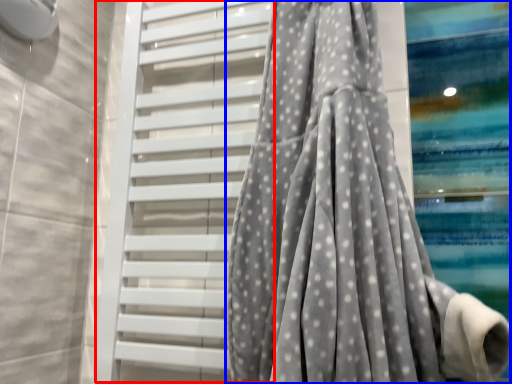
Question: Among these objects, which one is nearest to the camera, shutter (highlighted by a red box) or curtain (highlighted by a blue box)?

Choices:
 (A) shutter
 (B) curtain

Answer: (B)